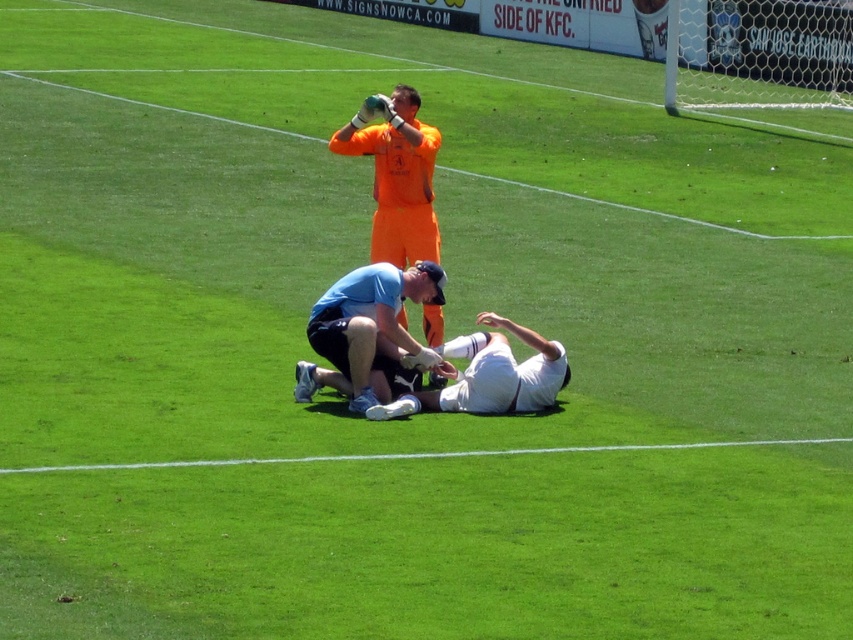
Looking at this image, you are a referee on the soccer field. You see the blue fabric knee at center and the white matte uniform at center. Which one is higher in position?

The blue fabric knee at center has a greater height compared to the white matte uniform at center, so the blue fabric knee at center is higher.

You are a referee on the soccer field. You see the blue fabric knee at center and the white matte uniform at center. Which one is bigger in size?

The blue fabric knee at center is larger in size than the white matte uniform at center.